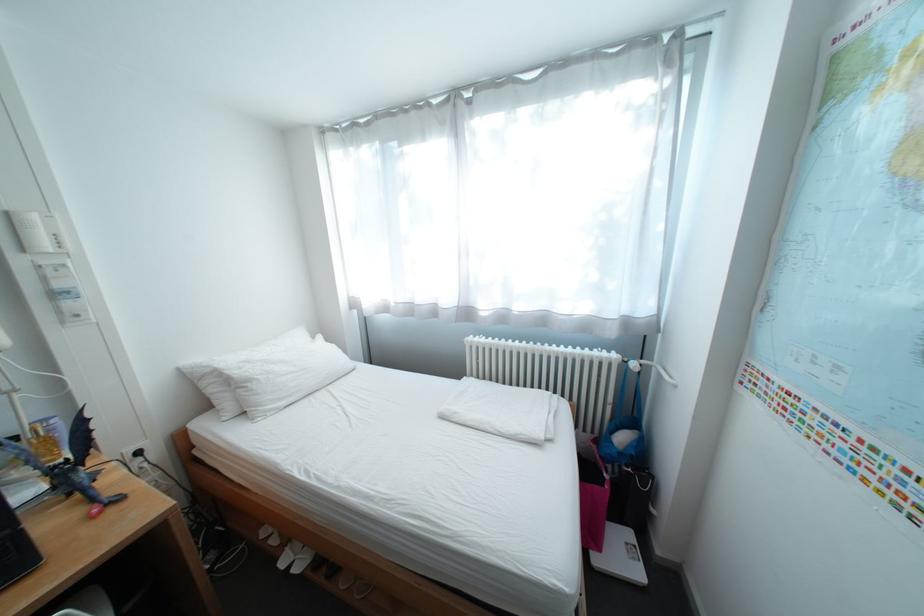
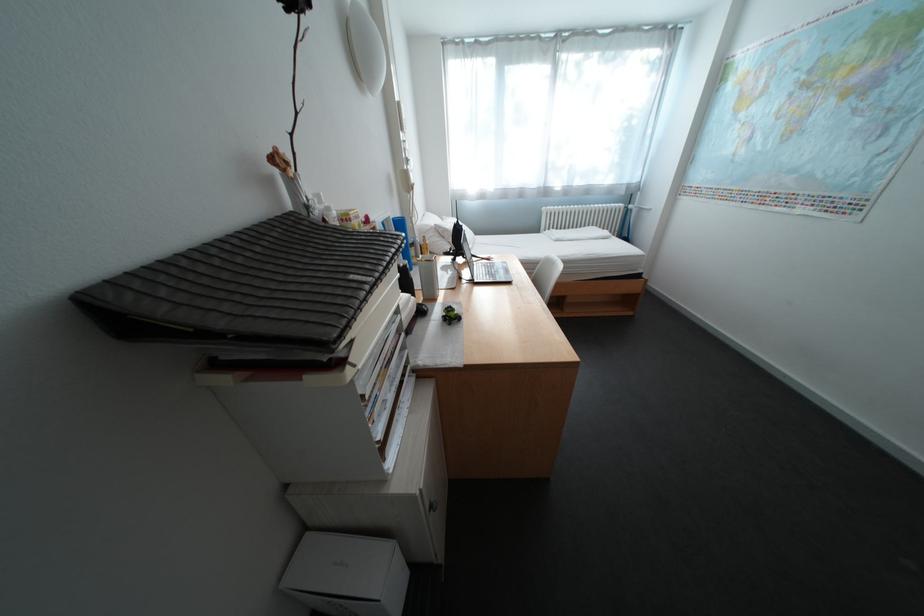
Which direction would the cameraman need to move to produce the second image?

The cameraman walked toward left, backward.